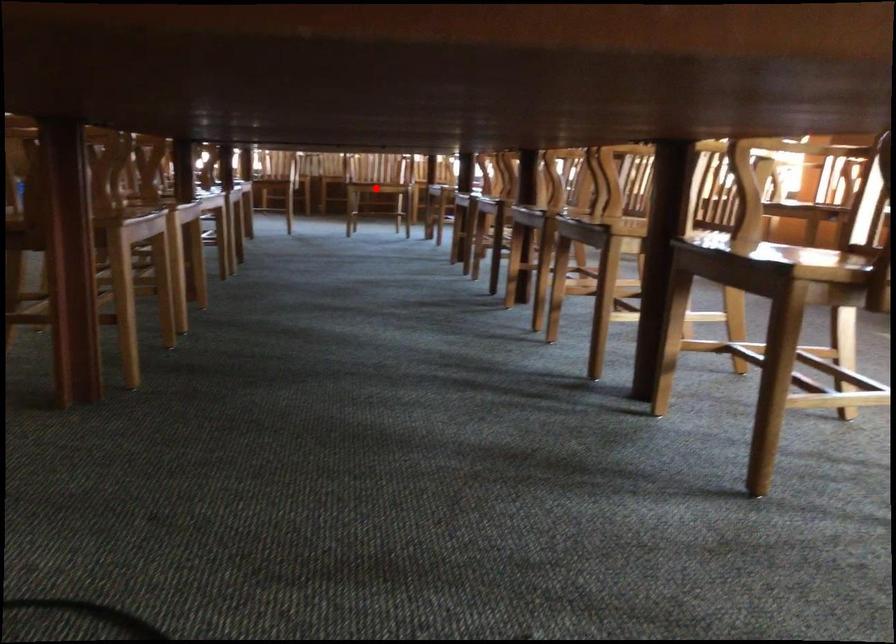
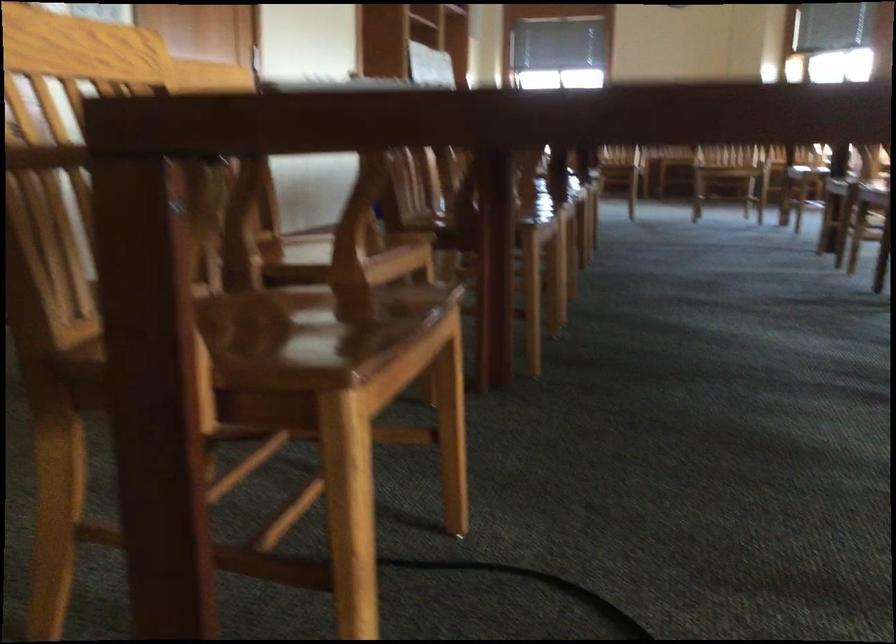
Question: I am providing you with two images of the same scene from different viewpoints. A red point is marked on the first image. Is the red point's position out of view in image 2?

Choices:
 (A) Yes
 (B) No

Answer: (A)